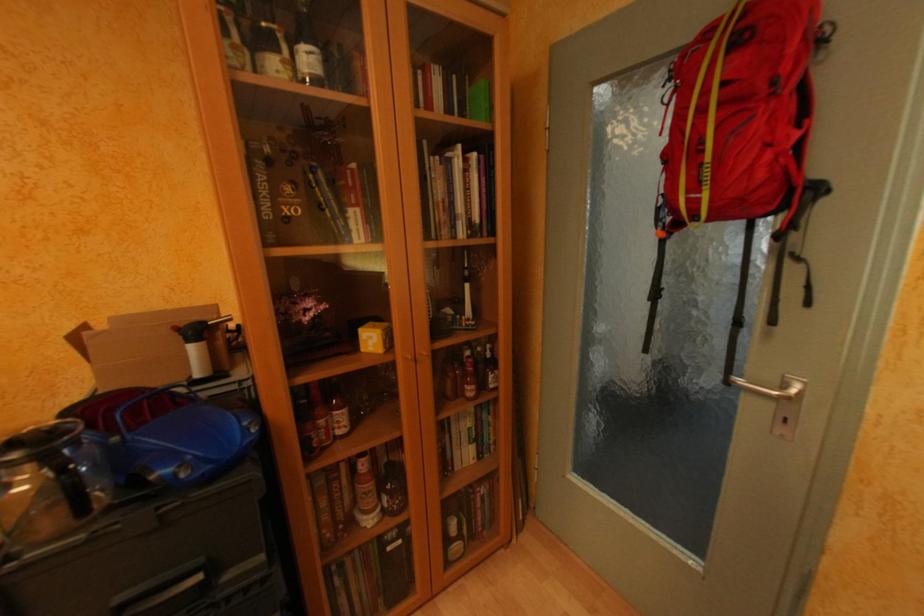
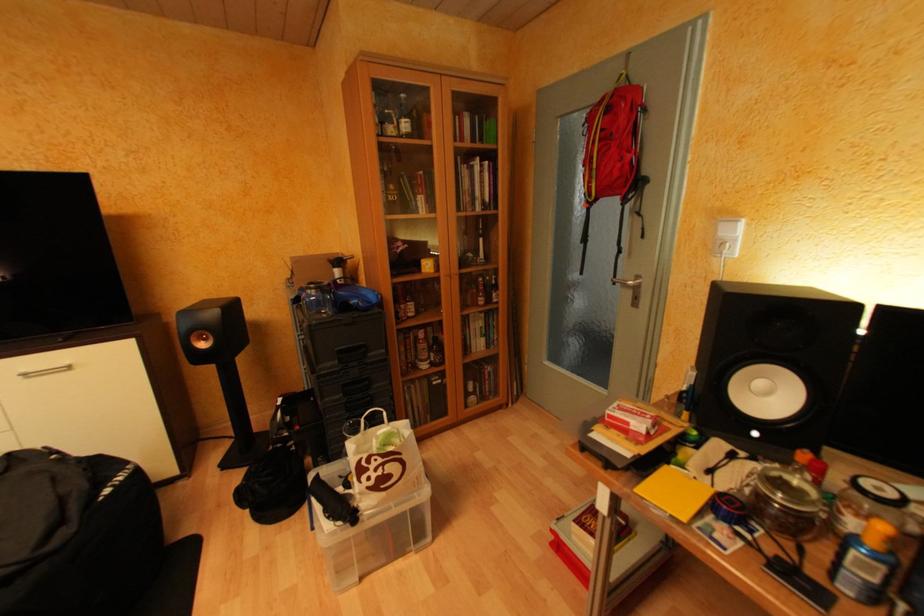
Question: In a continuous first-person perspective shot, in which direction is the camera moving?

Choices:
 (A) Left
 (B) Right
 (C) Forward
 (D) Backward

Answer: (D)